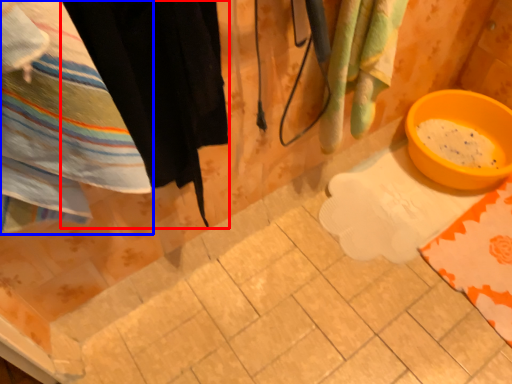
Question: Which of the following is the farthest to the observer, clothing (highlighted by a red box) or towel (highlighted by a blue box)?

Choices:
 (A) clothing
 (B) towel

Answer: (A)